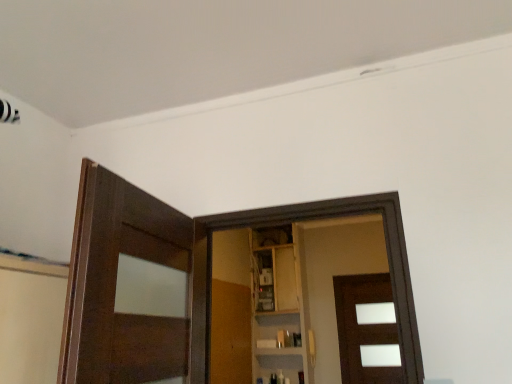
Question: Can you confirm if wooden at center is smaller than brown matte door at center?

Choices:
 (A) yes
 (B) no

Answer: (B)

Question: Considering the relative sizes of wooden at center and brown matte door at center in the image provided, is wooden at center thinner than brown matte door at center?

Choices:
 (A) no
 (B) yes

Answer: (B)

Question: From a real-world perspective, is wooden at center physically above brown matte door at center?

Choices:
 (A) no
 (B) yes

Answer: (B)

Question: Can you confirm if wooden at center is wider than brown matte door at center?

Choices:
 (A) no
 (B) yes

Answer: (A)

Question: Is wooden at center not close to brown matte door at center?

Choices:
 (A) yes
 (B) no

Answer: (A)

Question: Is wooden at center outside brown matte door at center?

Choices:
 (A) no
 (B) yes

Answer: (B)

Question: From the image's perspective, is wooden at center located beneath wooden cabinet at center?

Choices:
 (A) yes
 (B) no

Answer: (A)

Question: Is there a large distance between wooden at center and wooden cabinet at center?

Choices:
 (A) no
 (B) yes

Answer: (A)

Question: Does wooden at center have a lesser width compared to wooden cabinet at center?

Choices:
 (A) no
 (B) yes

Answer: (B)

Question: Is wooden at center positioned with its back to wooden cabinet at center?

Choices:
 (A) yes
 (B) no

Answer: (B)

Question: From a real-world perspective, is wooden at center located higher than wooden cabinet at center?

Choices:
 (A) yes
 (B) no

Answer: (B)

Question: Is wooden at center touching wooden cabinet at center?

Choices:
 (A) yes
 (B) no

Answer: (B)

Question: Is brown matte door at center positioned with its back to wooden at center?

Choices:
 (A) yes
 (B) no

Answer: (B)